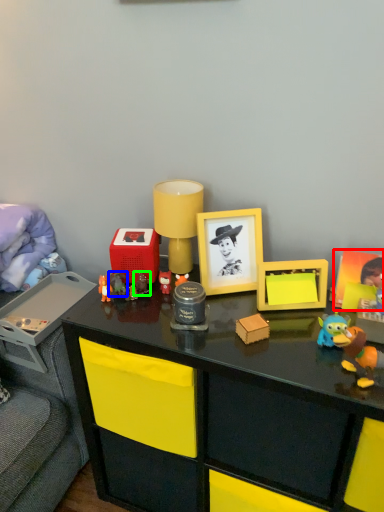
Question: Which is nearer to the picture frame (highlighted by a red box)? toy (highlighted by a blue box) or toy (highlighted by a green box).

Choices:
 (A) toy
 (B) toy

Answer: (B)